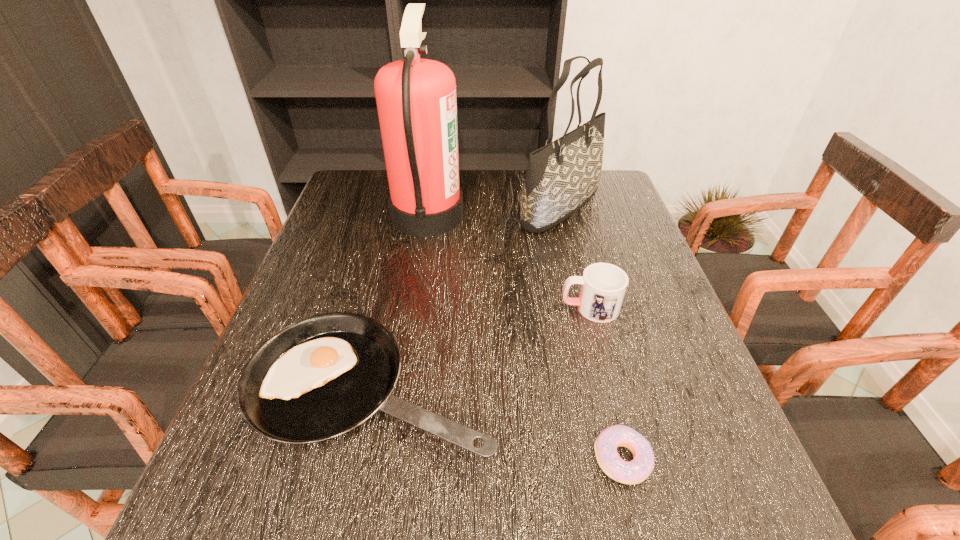
Image resolution: width=960 pixels, height=540 pixels. I want to click on object at the far right corner, so click(x=561, y=177).

In order to click on object that is at the near right corner in this screenshot , I will do [x=635, y=471].

In the image, there is a desktop. In order to click on vacant space at the far edge in this screenshot , I will do `click(467, 191)`.

Image resolution: width=960 pixels, height=540 pixels. Identify the location of vacant area at the near edge of the desktop. (523, 487).

In the image, there is a desktop. At what (x,y) coordinates should I click in order to perform the action: click on free space at the left edge. Please return your answer as a coordinate pair (x, y). Looking at the image, I should click on (358, 226).

What are the coordinates of `vacant space at the right edge of the desktop` in the screenshot? It's located at (644, 258).

Locate an element on the screen. The height and width of the screenshot is (540, 960). vacant area that lies between the fire extinguisher and the third shortest object is located at coordinates (509, 261).

Where is `free area in between the tote bag and the mug`? The image size is (960, 540). free area in between the tote bag and the mug is located at coordinates (575, 258).

Find the location of `vacant region between the second tallest object and the tallest object`. vacant region between the second tallest object and the tallest object is located at coordinates (494, 211).

Find the location of a particular element. This screenshot has width=960, height=540. empty space between the second shortest object and the third tallest object is located at coordinates (481, 349).